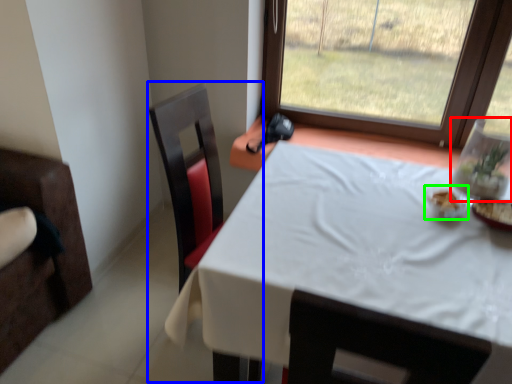
Question: Which object is the closest to the glass vase (highlighted by a red box)? Choose among these: swivel chair (highlighted by a blue box) or tableware (highlighted by a green box).

Choices:
 (A) swivel chair
 (B) tableware

Answer: (B)